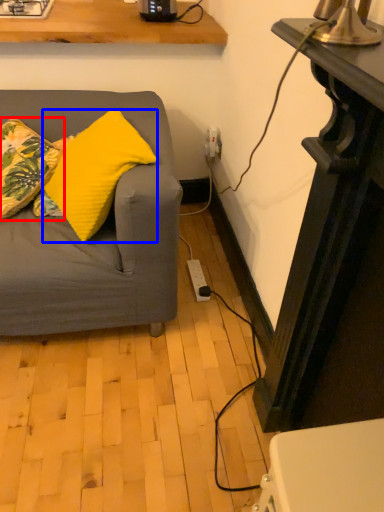
Question: Which object is closer to the camera taking this photo, pillow (highlighted by a red box) or pillow (highlighted by a blue box)?

Choices:
 (A) pillow
 (B) pillow

Answer: (B)